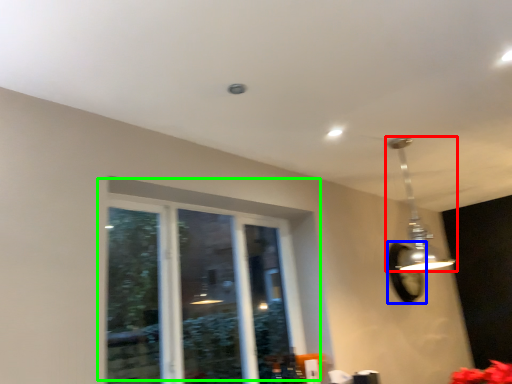
Question: Which is nearer to the lamp (highlighted by a red box)? mirror (highlighted by a blue box) or window (highlighted by a green box).

Choices:
 (A) mirror
 (B) window

Answer: (A)